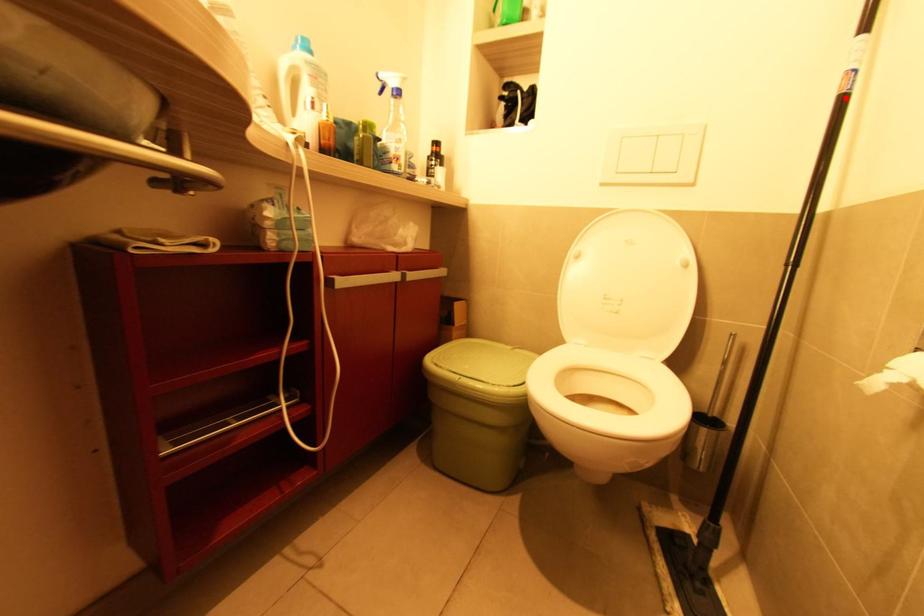
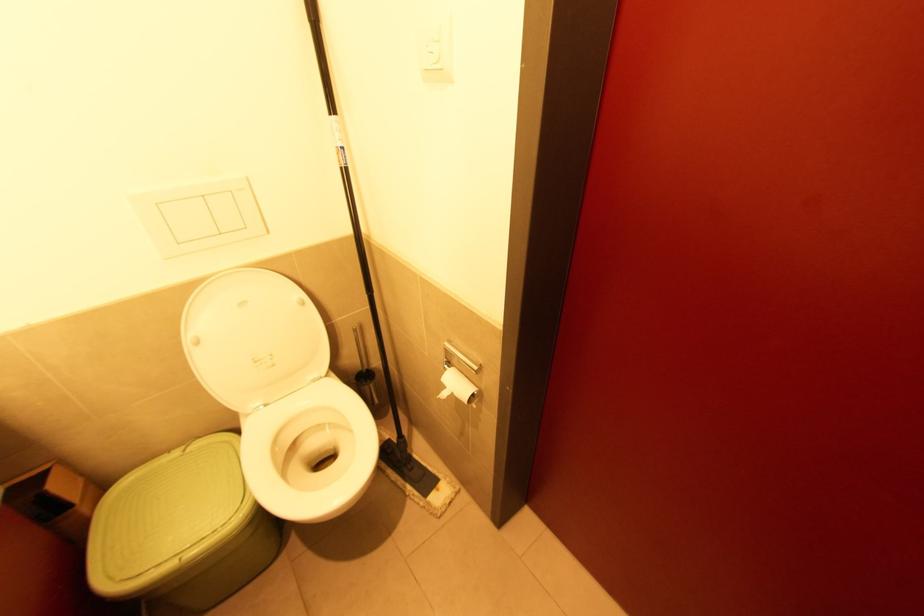
In the second image, find the point that corresponds to the highlighted location in the first image.

(347, 172)